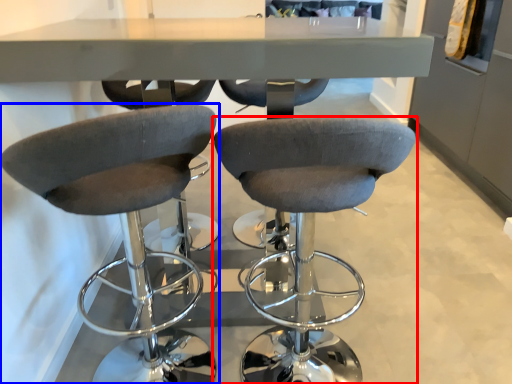
Question: Which point is further to the camera, chair (highlighted by a red box) or chair (highlighted by a blue box)?

Choices:
 (A) chair
 (B) chair

Answer: (A)